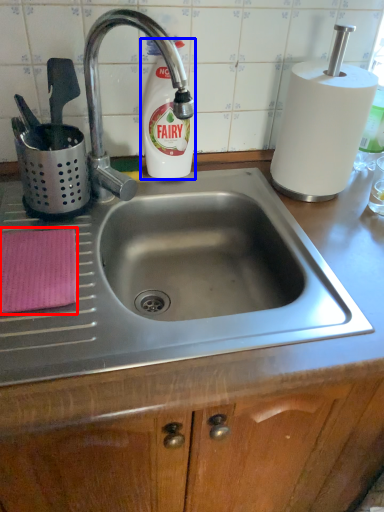
Question: Which object is further to the camera taking this photo, cloth (highlighted by a red box) or cleaning product (highlighted by a blue box)?

Choices:
 (A) cloth
 (B) cleaning product

Answer: (B)